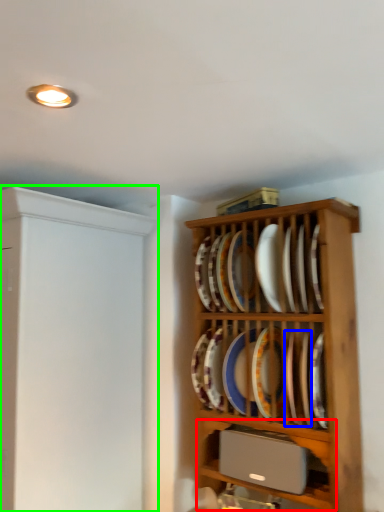
Question: Which object is the farthest from shelf (highlighted by a red box)? Choose among these: platter (highlighted by a blue box) or cabinetry (highlighted by a green box).

Choices:
 (A) platter
 (B) cabinetry

Answer: (B)